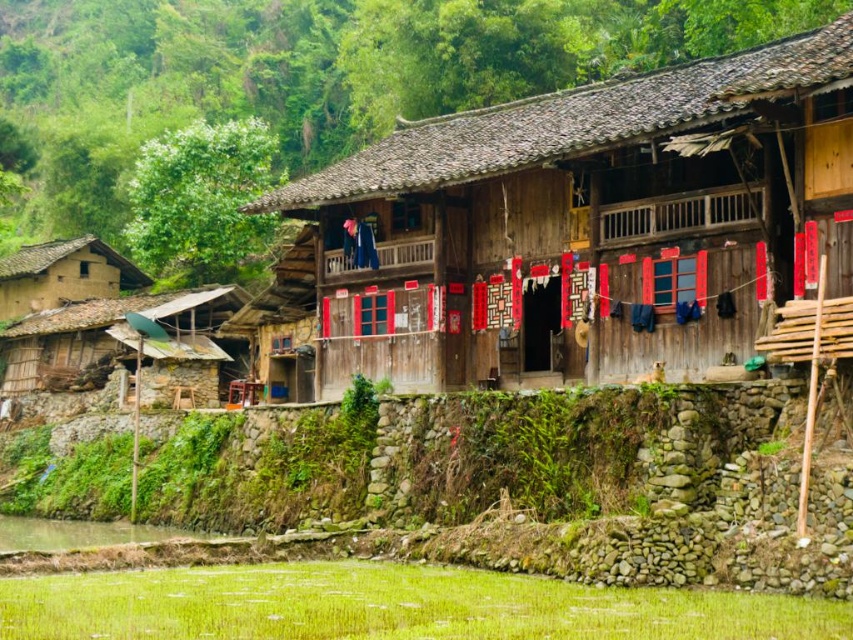
You are standing at the point with coordinates point [584,218]. Based on the scene, what structure are you currently located at?

The point [584,218] corresponds to the wooden house at center, so you are located at the wooden house at center.

You are standing at the point marked by the coordinate point (x=584, y=218) in the image. What structure are you directly at?

The point (x=584, y=218) marks the wooden house at center, so you are directly at the wooden house at center.